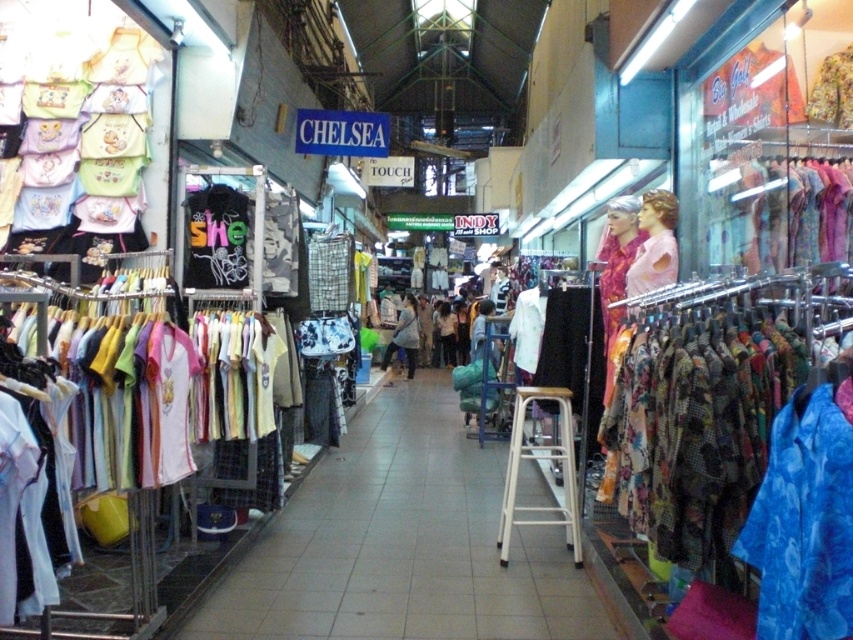
What are the coordinates of `floral fabric dress at center` in the screenshot? It's located at (618, 259).

Image resolution: width=853 pixels, height=640 pixels. Describe the element at coordinates (618, 259) in the screenshot. I see `floral fabric dress at center` at that location.

I want to click on floral fabric dress at center, so click(618, 259).

At what (x,y) coordinates should I click in order to perform the action: click on floral fabric dress at center. Please return your answer as a coordinate pair (x, y). The width and height of the screenshot is (853, 640). Looking at the image, I should click on (618, 259).

You are a GUI agent. You are given a task and a screenshot of the screen. Output one action in this format:
    pyautogui.click(x=<x>, y=<y>)
    Task: Click on the blue floral fabric shirt at right
    This screenshot has width=853, height=640.
    Given the screenshot: What is the action you would take?
    pyautogui.click(x=804, y=522)

Which is in front, point (805, 588) or point (386, 353)?

Point (805, 588) is in front.

You are a GUI agent. You are given a task and a screenshot of the screen. Output one action in this format:
    pyautogui.click(x=<x>, y=<y>)
    Task: Click on the blue floral fabric shirt at right
    This screenshot has height=640, width=853.
    Given the screenshot: What is the action you would take?
    pyautogui.click(x=804, y=522)

Between point (799, 237) and point (621, 237), which one is positioned in front?

Point (799, 237)

Who is more forward, (805,236) or (625,275)?

Point (805,236) is in front.

I want to click on printed fabric dress at right, so click(780, 212).